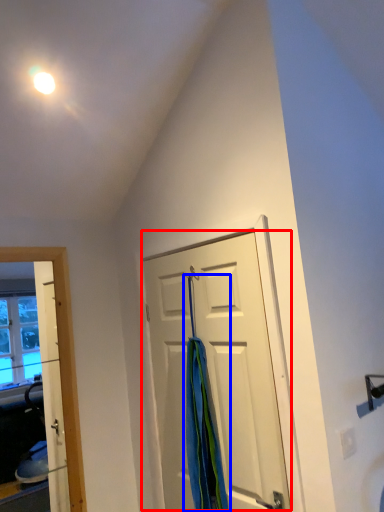
Question: Which point is closer to the camera, door (highlighted by a red box) or shower curtain (highlighted by a blue box)?

Choices:
 (A) door
 (B) shower curtain

Answer: (A)